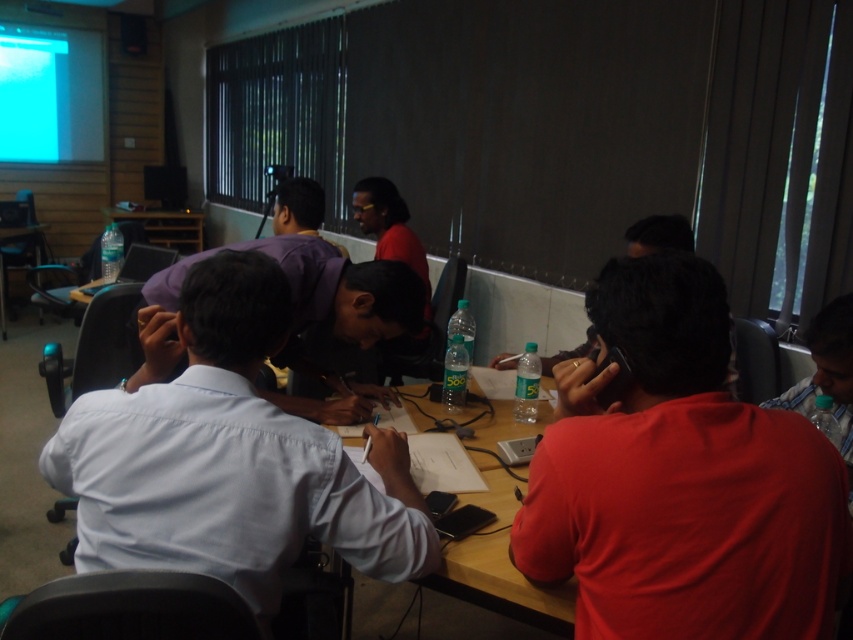
Question: Is red matte shirt at right below wooden table at left?

Choices:
 (A) yes
 (B) no

Answer: (A)

Question: Which object appears farthest from the camera in this image?

Choices:
 (A) wooden table at left
 (B) wooden table at center
 (C) wooden at center

Answer: (C)

Question: Which object is closer to the camera taking this photo?

Choices:
 (A) wooden at center
 (B) white cotton shirt at center

Answer: (B)

Question: Does wooden at center lie in front of wooden table at left?

Choices:
 (A) yes
 (B) no

Answer: (B)

Question: Does wooden at center appear on the right side of wooden table at left?

Choices:
 (A) no
 (B) yes

Answer: (B)

Question: Which object is positioned farthest from the wooden at center?

Choices:
 (A) wooden table at left
 (B) white cotton shirt at center
 (C) red matte shirt at right
 (D) wooden table at center

Answer: (C)